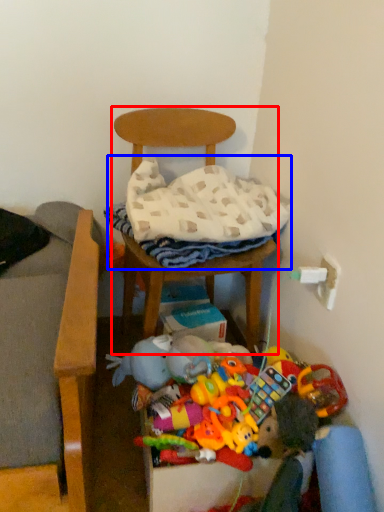
Question: Which of the following is the closest to the observer, chair (highlighted by a red box) or blanket (highlighted by a blue box)?

Choices:
 (A) chair
 (B) blanket

Answer: (A)